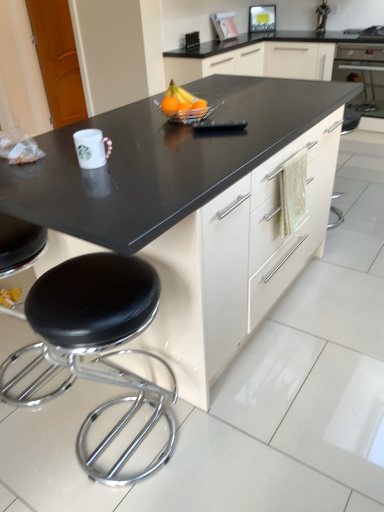
Question: Is orange matte at center, the first orange from the right, at the left side of black leather stool at lower left?

Choices:
 (A) yes
 (B) no

Answer: (B)

Question: Does orange matte at center, the first orange from the right, appear on the right side of black leather stool at lower left?

Choices:
 (A) yes
 (B) no

Answer: (A)

Question: Considering the relative sizes of orange matte at center, which appears as the second orange when viewed from the left, and black leather stool at lower left in the image provided, is orange matte at center, which appears as the second orange when viewed from the left, shorter than black leather stool at lower left?

Choices:
 (A) yes
 (B) no

Answer: (A)

Question: Is orange matte at center, which appears as the second orange when viewed from the left, positioned behind black leather stool at lower left?

Choices:
 (A) no
 (B) yes

Answer: (B)

Question: Is orange matte at center, the first orange from the right, thinner than black leather stool at lower left?

Choices:
 (A) yes
 (B) no

Answer: (A)

Question: Can you confirm if orange matte at center, the first orange from the right, is taller than black leather stool at lower left?

Choices:
 (A) yes
 (B) no

Answer: (B)

Question: Is the position of orange matte at center, the first orange from the right, more distant than that of orange matte at center, positioned as the first orange in left-to-right order?

Choices:
 (A) yes
 (B) no

Answer: (A)

Question: Considering the relative sizes of orange matte at center, the first orange from the right, and orange matte at center, positioned as the first orange in left-to-right order, in the image provided, is orange matte at center, the first orange from the right, taller than orange matte at center, positioned as the first orange in left-to-right order,?

Choices:
 (A) yes
 (B) no

Answer: (B)

Question: Is orange matte at center, positioned as the 2th orange in right-to-left order, surrounded by orange matte at center, which appears as the second orange when viewed from the left?

Choices:
 (A) yes
 (B) no

Answer: (B)

Question: Is orange matte at center, which appears as the second orange when viewed from the left, not inside orange matte at center, positioned as the first orange in left-to-right order?

Choices:
 (A) no
 (B) yes

Answer: (B)

Question: Does orange matte at center, the first orange from the right, have a lesser height compared to orange matte at center, positioned as the 2th orange in right-to-left order?

Choices:
 (A) no
 (B) yes

Answer: (B)

Question: From the image's perspective, is orange matte at center, which appears as the second orange when viewed from the left, below orange matte at center, positioned as the 2th orange in right-to-left order?

Choices:
 (A) no
 (B) yes

Answer: (B)

Question: Can we say orange matte at center, positioned as the first orange in left-to-right order, lies outside black glossy oven at upper right?

Choices:
 (A) no
 (B) yes

Answer: (B)